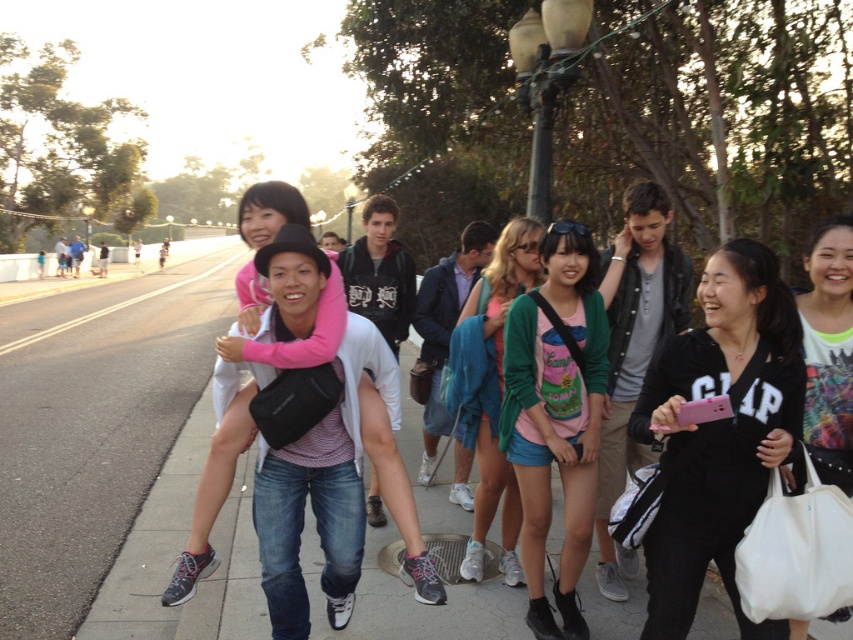
Question: Based on their relative distances, which object is nearer to the black leather jacket at right?

Choices:
 (A) matte pink shirt at center
 (B) white fabric bag at lower right
 (C) black zip-up hoodie at center
 (D) gray asphalt sidewalk at lower left

Answer: (A)

Question: Considering the relative positions of gray asphalt sidewalk at lower left and matte green sweater at center in the image provided, where is gray asphalt sidewalk at lower left located with respect to matte green sweater at center?

Choices:
 (A) right
 (B) left

Answer: (B)

Question: Does black leather jacket at right appear over matte pink shirt at center?

Choices:
 (A) yes
 (B) no

Answer: (A)

Question: Which of the following is the farthest from the observer?

Choices:
 (A) (630, 193)
 (B) (683, 598)
 (C) (490, 472)

Answer: (C)

Question: Estimate the real-world distances between objects in this image. Which object is closer to the black leather jacket at right?

Choices:
 (A) matte green sweater at center
 (B) white fabric bag at lower right

Answer: (A)

Question: Can you confirm if black leather jacket at right is smaller than white fabric bag at lower right?

Choices:
 (A) no
 (B) yes

Answer: (A)